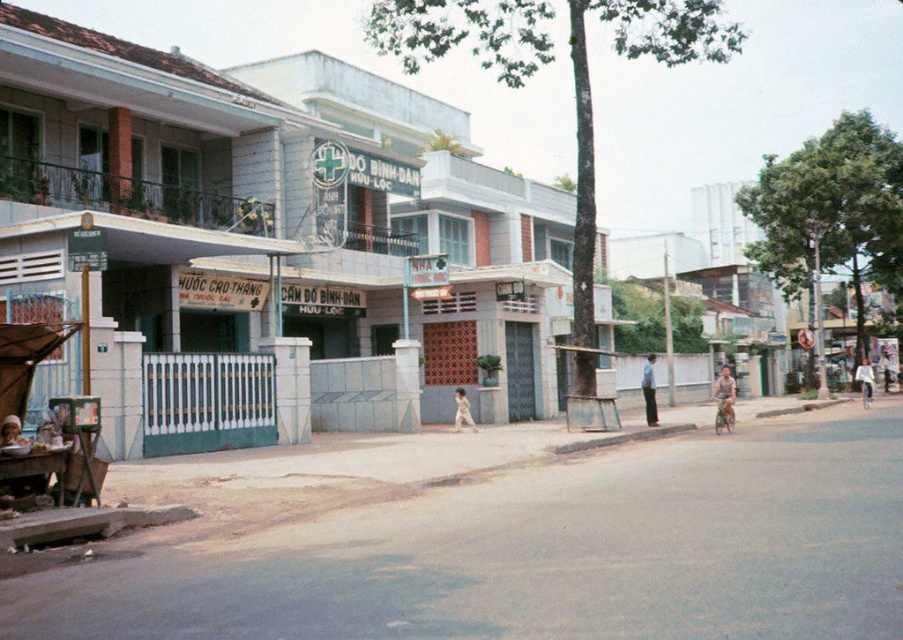
Question: Among these points, which one is nearest to the camera?

Choices:
 (A) (272, 122)
 (B) (3, 428)
 (C) (645, 403)
 (D) (464, 420)

Answer: (B)

Question: Which object appears farthest from the camera in this image?

Choices:
 (A) light brown wooden bicycle at center-right
 (B) light brown leather jacket at center
 (C) white concrete building at center
 (D) smooth skin face at center

Answer: (A)

Question: Does light brown wooden bicycle at center-right have a lesser width compared to smooth skin face at center?

Choices:
 (A) no
 (B) yes

Answer: (A)

Question: Which object is farther from the camera taking this photo?

Choices:
 (A) light brown wooden bicycle at center-right
 (B) light blue shirt at center

Answer: (B)

Question: Can you confirm if dark blue pants at center is thinner than light blue shirt at center?

Choices:
 (A) no
 (B) yes

Answer: (B)

Question: Is light blue shirt at center positioned at the back of light brown leather jacket at center?

Choices:
 (A) no
 (B) yes

Answer: (B)